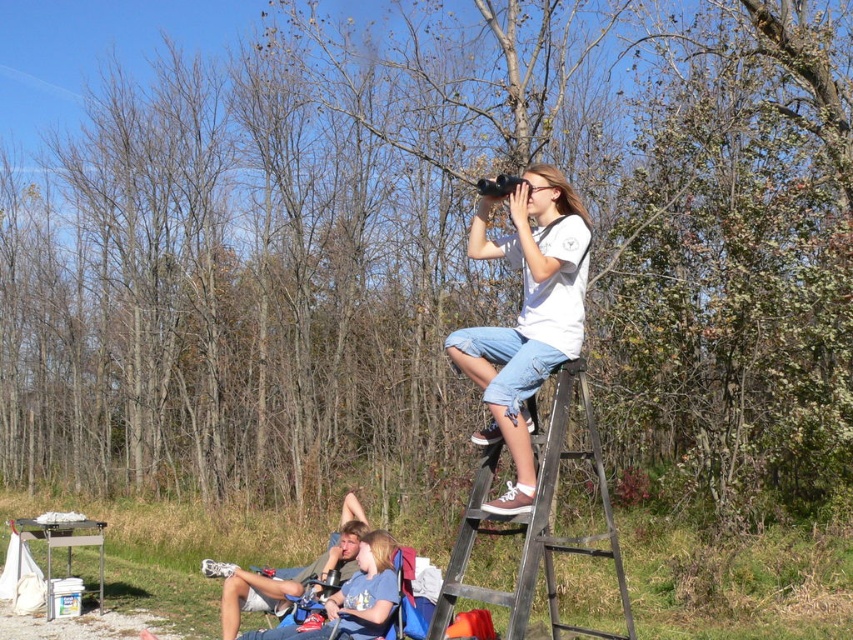
Question: Based on their relative distances, which object is nearer to the denim shorts at lower left?

Choices:
 (A) white cotton shirt at upper center
 (B) metallic silver ladder at upper right

Answer: (B)

Question: Which object is farther from the camera taking this photo?

Choices:
 (A) white cotton shirt at upper center
 (B) metallic silver ladder at upper right

Answer: (A)

Question: Estimate the real-world distances between objects in this image. Which object is closer to the denim shorts at lower left?

Choices:
 (A) metallic silver ladder at upper right
 (B) white cotton shirt at upper center

Answer: (A)

Question: Does metallic silver ladder at upper right come behind denim shorts at lower left?

Choices:
 (A) yes
 (B) no

Answer: (B)

Question: Does white cotton shirt at upper center have a greater width compared to metallic silver ladder at upper right?

Choices:
 (A) yes
 (B) no

Answer: (B)

Question: Considering the relative positions of white cotton shirt at upper center and denim shorts at lower left in the image provided, where is white cotton shirt at upper center located with respect to denim shorts at lower left?

Choices:
 (A) right
 (B) left

Answer: (A)